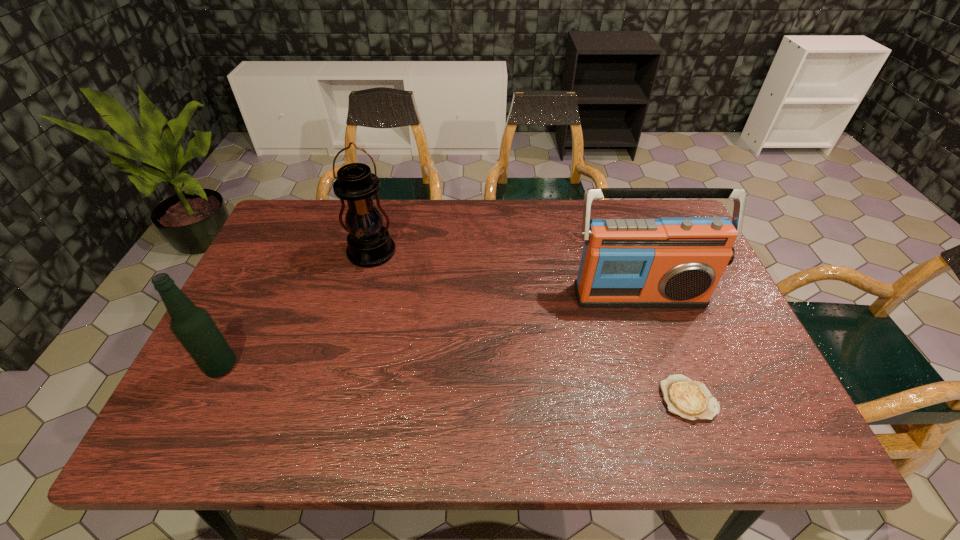
Identify the location of free space that is in between the farthest object and the radio receiver. (505, 274).

The image size is (960, 540). I want to click on free spot between the leftmost object and the third nearest object, so click(430, 330).

Locate an element on the screen. This screenshot has width=960, height=540. object that stands as the second closest to the quiche is located at coordinates (369, 244).

Point out which object is positioned as the second nearest to the radio receiver. Please provide its 2D coordinates. Your answer should be formatted as a tuple, i.e. [(x, y)], where the tuple contains the x and y coordinates of a point satisfying the conditions above.

[(369, 244)]

Locate an element on the screen. The width and height of the screenshot is (960, 540). vacant space that satisfies the following two spatial constraints: 1. above the shortest object, indicating its light source; 2. on the left side of the second object from left to right is located at coordinates (333, 399).

Identify the location of vacant region that satisfies the following two spatial constraints: 1. on the front-facing side of the quiche; 2. on the left side of the second farthest object. This screenshot has height=540, width=960. click(x=675, y=399).

Identify the location of vacant region that satisfies the following two spatial constraints: 1. above the farthest object, indicating its light source; 2. on the left side of the shortest object. (333, 399).

This screenshot has height=540, width=960. Find the location of `free space that satisfies the following two spatial constraints: 1. on the front-facing side of the quiche; 2. on the right side of the radio receiver`. free space that satisfies the following two spatial constraints: 1. on the front-facing side of the quiche; 2. on the right side of the radio receiver is located at coordinates (675, 399).

You are a GUI agent. You are given a task and a screenshot of the screen. Output one action in this format:
    pyautogui.click(x=<x>, y=<y>)
    Task: Click on the vacant position in the image that satisfies the following two spatial constraints: 1. above the lantern, indicating its light source; 2. on the left side of the quiche
    This screenshot has width=960, height=540.
    Given the screenshot: What is the action you would take?
    pyautogui.click(x=333, y=399)